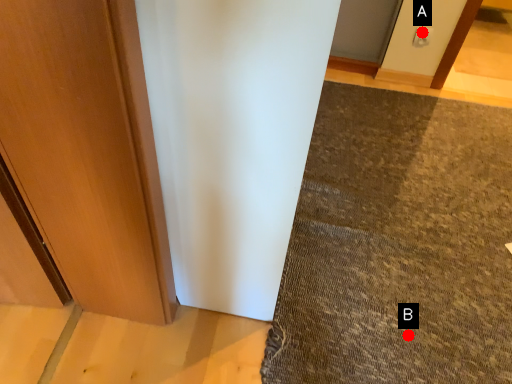
Question: Two points are circled on the image, labeled by A and B beside each circle. Which point is farther from the camera taking this photo?

Choices:
 (A) A is further
 (B) B is further

Answer: (A)